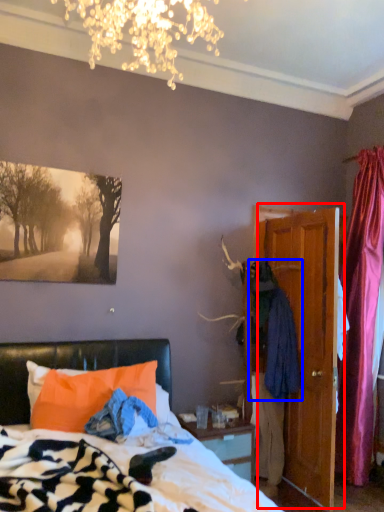
Question: Which point is further to the camera, door (highlighted by a red box) or clothing (highlighted by a blue box)?

Choices:
 (A) door
 (B) clothing

Answer: (B)